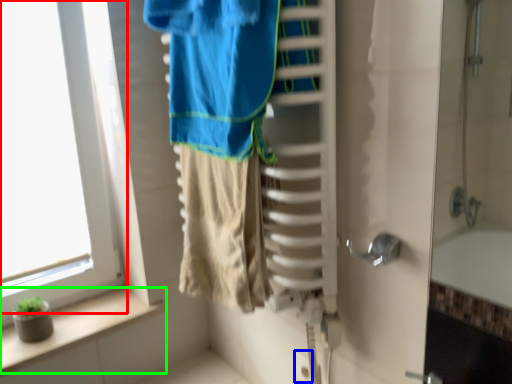
Question: Which object is positioned farthest from window (highlighted by a red box)? Select from electric outlet (highlighted by a blue box) and balustrade (highlighted by a green box).

Choices:
 (A) electric outlet
 (B) balustrade

Answer: (A)